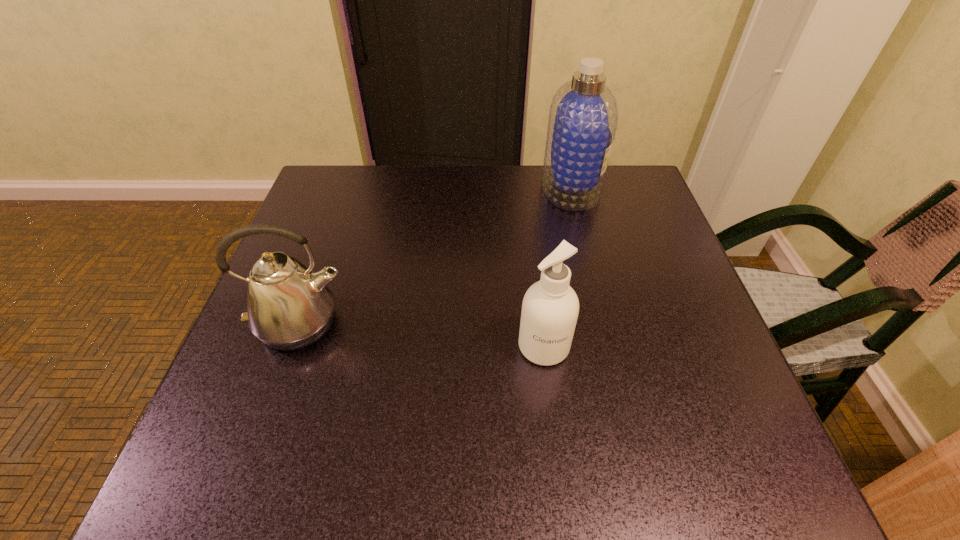
Locate an element on the screen. This screenshot has width=960, height=540. the taller cleansing agent is located at coordinates (583, 118).

Where is `the farther cleansing agent`? The height and width of the screenshot is (540, 960). the farther cleansing agent is located at coordinates (583, 118).

Identify the location of kettle. (289, 307).

I want to click on the shorter cleansing agent, so click(550, 308).

This screenshot has height=540, width=960. Identify the location of free spot located on the front of the farther cleansing agent. (609, 341).

The image size is (960, 540). I want to click on free location located 0.070m on the right of the kettle, so coord(386,323).

Identify the location of free region located 0.170m on the front label of the shorter cleansing agent. The height and width of the screenshot is (540, 960). (558, 463).

The height and width of the screenshot is (540, 960). In order to click on object that is at the far edge in this screenshot , I will do `click(583, 118)`.

Where is `object that is positioned at the left edge`? object that is positioned at the left edge is located at coordinates (289, 307).

Image resolution: width=960 pixels, height=540 pixels. I want to click on object present at the right edge, so click(x=583, y=118).